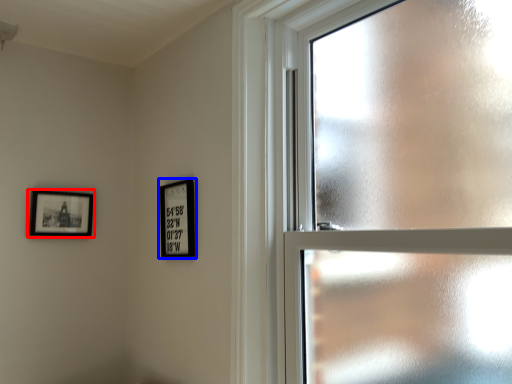
Question: Which object is closer to the camera taking this photo, picture frame (highlighted by a red box) or picture frame (highlighted by a blue box)?

Choices:
 (A) picture frame
 (B) picture frame

Answer: (B)